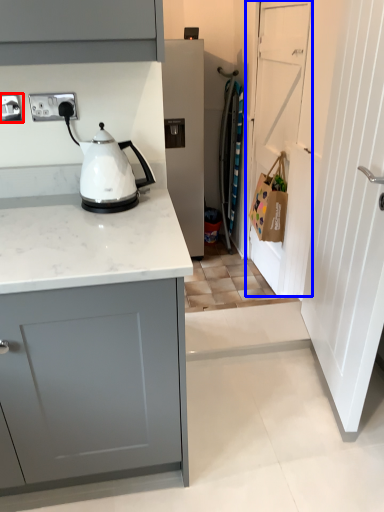
Question: Which of the following is the farthest to the observer, electric outlet (highlighted by a red box) or door (highlighted by a blue box)?

Choices:
 (A) electric outlet
 (B) door

Answer: (B)